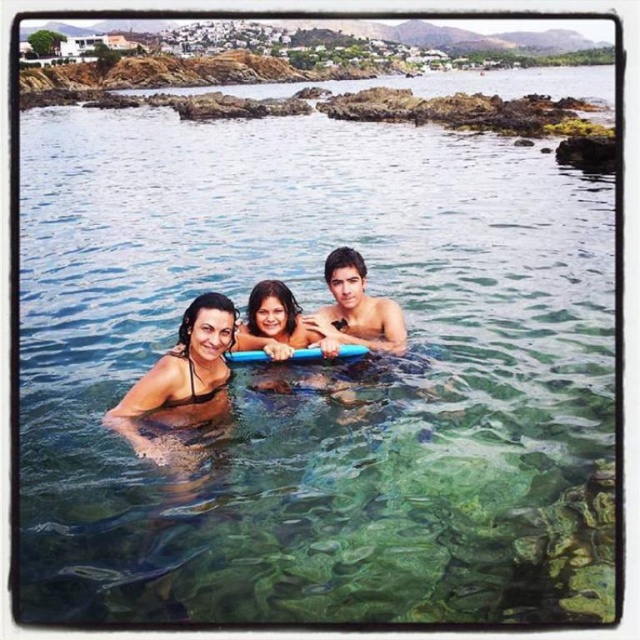
Question: Is black matte swimwear at center wider than smooth skin man at center?

Choices:
 (A) no
 (B) yes

Answer: (B)

Question: Which object appears farthest from the camera in this image?

Choices:
 (A) smooth skin man at center
 (B) black matte swimwear at center

Answer: (A)

Question: Which object appears farthest from the camera in this image?

Choices:
 (A) black matte swimwear at center
 (B) smooth skin man at center

Answer: (B)

Question: Where is black matte swimwear at center located in relation to smooth skin man at center in the image?

Choices:
 (A) below
 (B) above

Answer: (A)

Question: Is black matte swimwear at center positioned in front of smooth skin man at center?

Choices:
 (A) no
 (B) yes

Answer: (B)